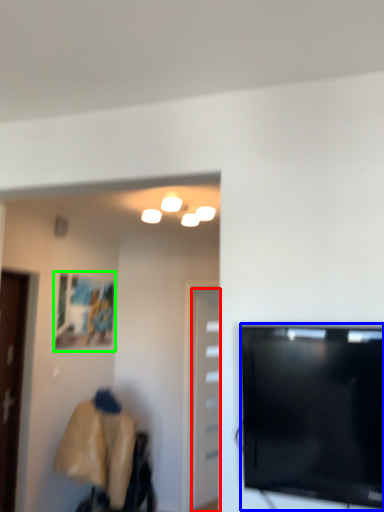
Question: Considering the real-world distances, which object is farthest from door (highlighted by a red box)? television (highlighted by a blue box) or picture frame (highlighted by a green box)?

Choices:
 (A) television
 (B) picture frame

Answer: (A)